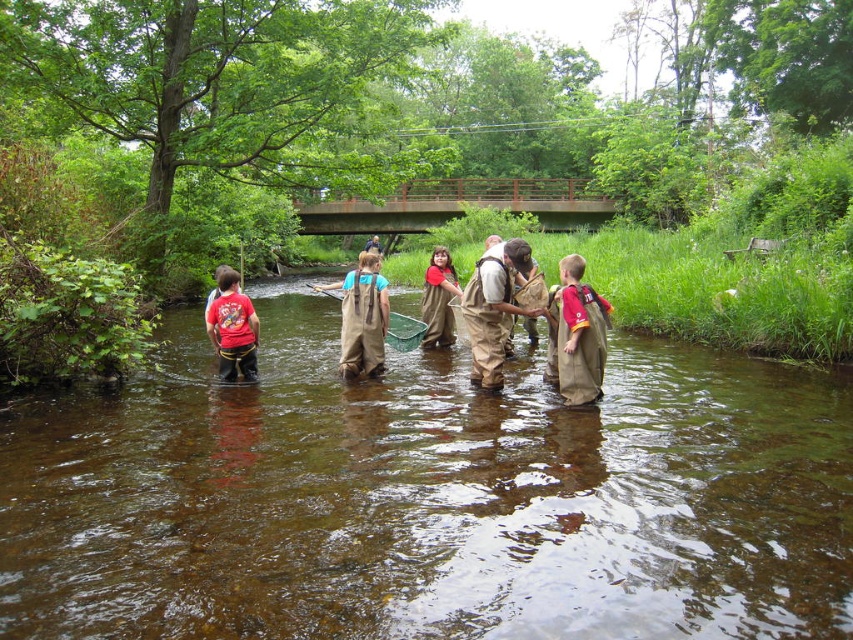
Measure the distance from brown waterproof vest at center to brown canvas waders at center.

brown waterproof vest at center and brown canvas waders at center are 3.01 meters apart.

Between brown waterproof vest at center and brown canvas waders at center, which one is positioned higher?

brown canvas waders at center is above.

Measure the distance between brown waterproof vest at center and camera.

brown waterproof vest at center is 7.40 meters from camera.

The image size is (853, 640). I want to click on brown waterproof vest at center, so click(579, 333).

Which is behind, point (564, 369) or point (448, 291)?

Point (448, 291)

Is point (564, 333) behind point (448, 259)?

No, (564, 333) is in front of (448, 259).

Identify the location of brown waterproof vest at center. (579, 333).

Does point (468, 288) come behind point (431, 339)?

No, (468, 288) is closer to viewer.

Between brown waterproof boots at center and matte brown waders at center, which one has less height?

With less height is matte brown waders at center.

Is point (486, 376) farther from camera compared to point (430, 326)?

No, it is in front of (430, 326).

This screenshot has width=853, height=640. What are the coordinates of `brown waterproof boots at center` in the screenshot? It's located at (494, 307).